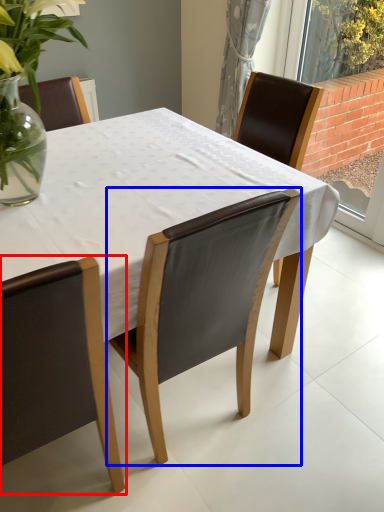
Question: Among these objects, which one is farthest to the camera, chair (highlighted by a red box) or chair (highlighted by a blue box)?

Choices:
 (A) chair
 (B) chair

Answer: (B)